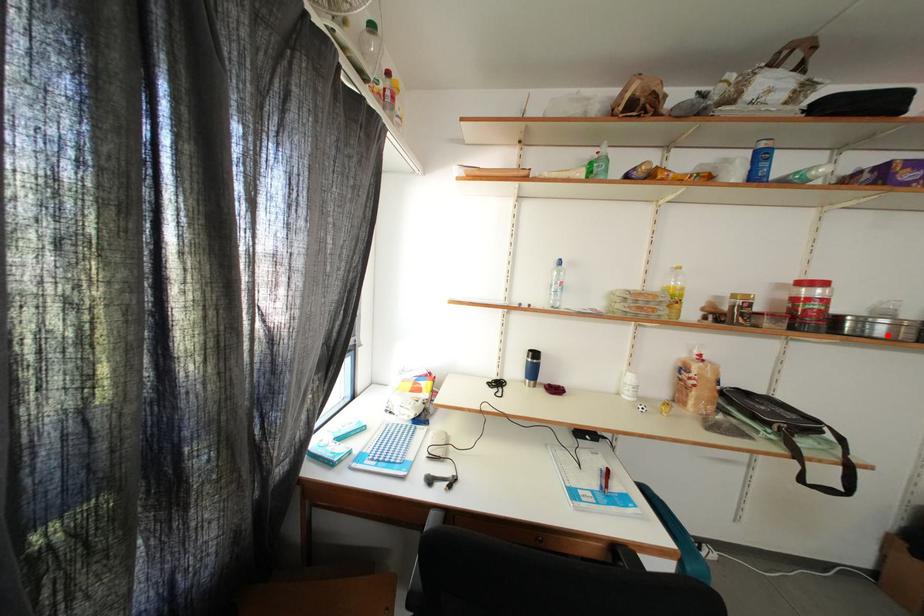
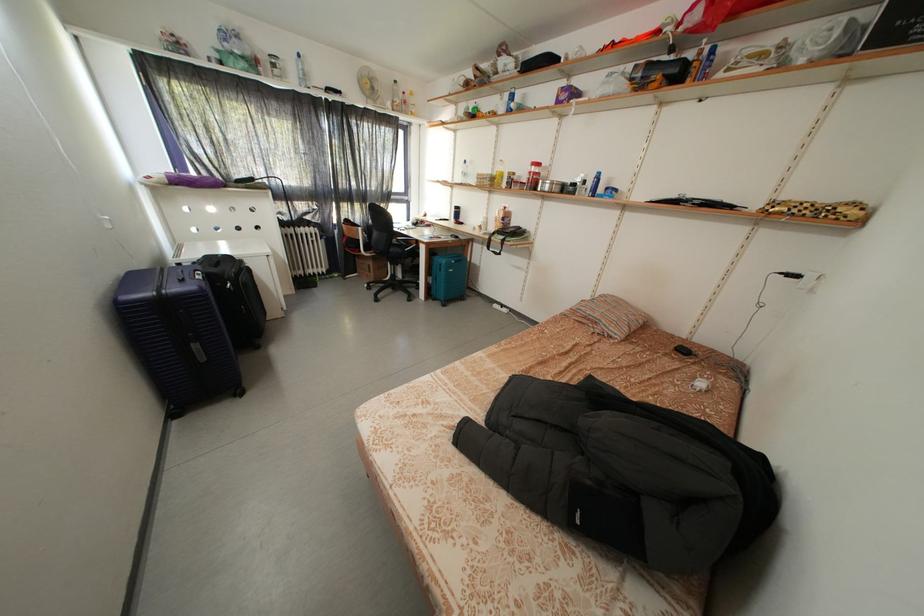
Question: I am providing you with two images of the same scene from different viewpoints. A red point is marked on the first image. At the location where the point appears in image 1, is it still visible in image 2?

Choices:
 (A) Yes
 (B) No

Answer: (A)